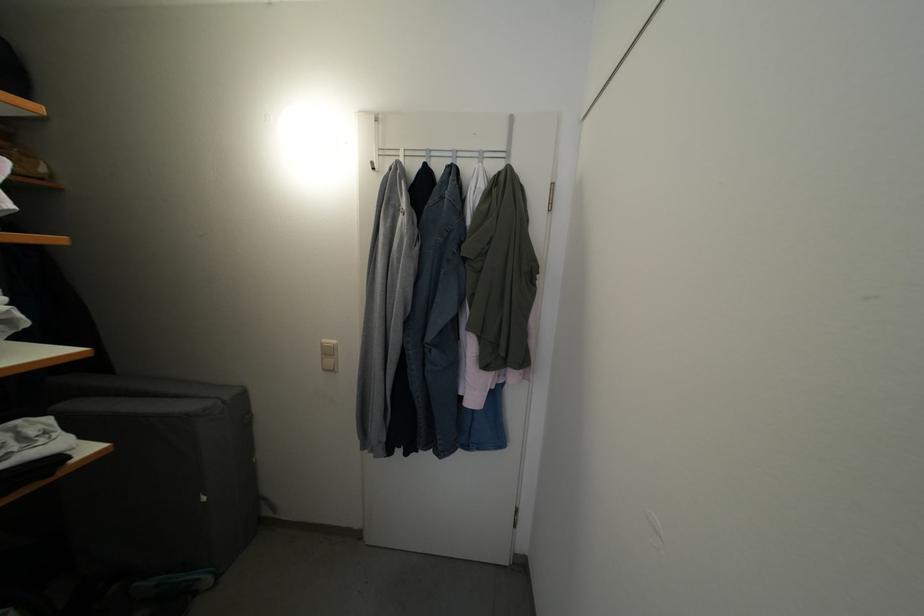
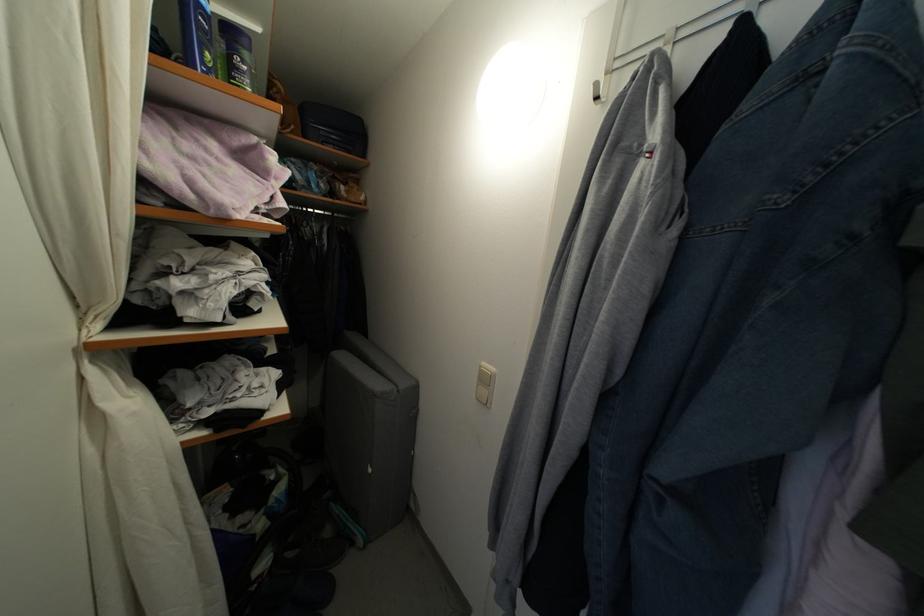
Locate, in the second image, the point that corresponds to the point at 330,346 in the first image.

(489, 370)